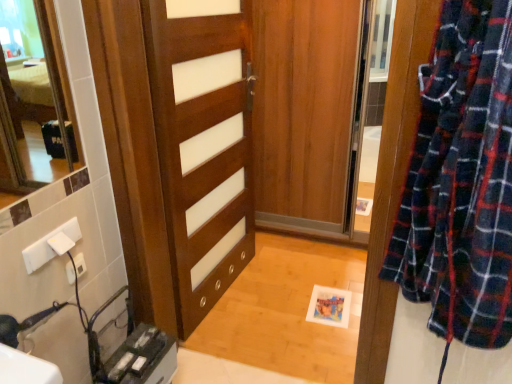
What is the approximate width of wooden door at center?

wooden door at center is 6.03 centimeters in width.

Identify the location of wooden door at center. (202, 144).

The image size is (512, 384). What do you see at coordinates (202, 144) in the screenshot?
I see `wooden door at center` at bounding box center [202, 144].

This screenshot has height=384, width=512. What do you see at coordinates (80, 264) in the screenshot?
I see `white plastic electric outlet at lower left` at bounding box center [80, 264].

Measure the distance between point (67, 270) and camera.

Point (67, 270) is 4.49 feet from camera.

Locate an element on the screen. The height and width of the screenshot is (384, 512). white plastic electric outlet at lower left is located at coordinates (80, 264).

What is the approximate width of white plastic electric outlet at lower left?

0.72 inches.

The width and height of the screenshot is (512, 384). In order to click on wooden door at center in this screenshot , I will do `click(202, 144)`.

Which is more to the left, wooden door at center or white plastic electric outlet at lower left?

From the viewer's perspective, white plastic electric outlet at lower left appears more on the left side.

Which object is further away from the camera, wooden door at center or white plastic electric outlet at lower left?

white plastic electric outlet at lower left is further from the camera.

Which is closer, (208, 247) or (78, 253)?

Point (208, 247) is farther from the camera than point (78, 253).

From the image's perspective, which object appears higher, wooden door at center or white plastic electric outlet at lower left?

wooden door at center, from the image's perspective.

From a real-world perspective, is wooden door at center below white plastic electric outlet at lower left?

No.

Is wooden door at center wider than white plastic electric outlet at lower left?

Correct, the width of wooden door at center exceeds that of white plastic electric outlet at lower left.

Who is shorter, wooden door at center or white plastic electric outlet at lower left?

white plastic electric outlet at lower left is shorter.

Is wooden door at center smaller than white plastic electric outlet at lower left?

Incorrect, wooden door at center is not smaller in size than white plastic electric outlet at lower left.

Do you think wooden door at center is within white plastic electric outlet at lower left, or outside of it?

The correct answer is: outside.

Is wooden door at center with white plastic electric outlet at lower left?

No.

Is wooden door at center facing away from white plastic electric outlet at lower left?

wooden door at center is not turned away from white plastic electric outlet at lower left.

Can you tell me how much wooden door at center and white plastic electric outlet at lower left differ in facing direction?

They differ by 4.58 degrees in their facing directions.

Identify the location of electric outlet to the left of wooden door at center. (80, 264).

Can you confirm if white plastic electric outlet at lower left is positioned to the left of wooden door at center?

Correct, you'll find white plastic electric outlet at lower left to the left of wooden door at center.

Is white plastic electric outlet at lower left in front of wooden door at center?

No, the depth of white plastic electric outlet at lower left is greater than that of wooden door at center.

Considering the positions of point (79, 271) and point (176, 230), is point (79, 271) closer or farther from the camera than point (176, 230)?

Point (79, 271) is positioned closer to the camera compared to point (176, 230).

From the image's perspective, is white plastic electric outlet at lower left located above or below wooden door at center?

Clearly, from the image's perspective, white plastic electric outlet at lower left is below wooden door at center.

From a real-world perspective, is white plastic electric outlet at lower left below wooden door at center?

Yes, from a real-world perspective, white plastic electric outlet at lower left is beneath wooden door at center.

Which object is wider, white plastic electric outlet at lower left or wooden door at center?

wooden door at center.

Does white plastic electric outlet at lower left have a lesser height compared to wooden door at center?

Correct, white plastic electric outlet at lower left is not as tall as wooden door at center.

In terms of size, does white plastic electric outlet at lower left appear bigger or smaller than wooden door at center?

Clearly, white plastic electric outlet at lower left is smaller in size than wooden door at center.

Is white plastic electric outlet at lower left inside or outside of wooden door at center?

white plastic electric outlet at lower left is not enclosed by wooden door at center.

Is white plastic electric outlet at lower left not near wooden door at center?

Actually, white plastic electric outlet at lower left and wooden door at center are a little close together.

Is white plastic electric outlet at lower left looking in the opposite direction of wooden door at center?

white plastic electric outlet at lower left does not have its back to wooden door at center.

Can you tell me how much white plastic electric outlet at lower left and wooden door at center differ in facing direction?

4.58 degrees.

Locate an element on the screen. door above the white plastic electric outlet at lower left (from the image's perspective) is located at coordinates (202, 144).

Where is `electric outlet below the wooden door at center (from a real-world perspective)`? This screenshot has height=384, width=512. electric outlet below the wooden door at center (from a real-world perspective) is located at coordinates (80, 264).

Identify the location of door on the right of white plastic electric outlet at lower left. (202, 144).